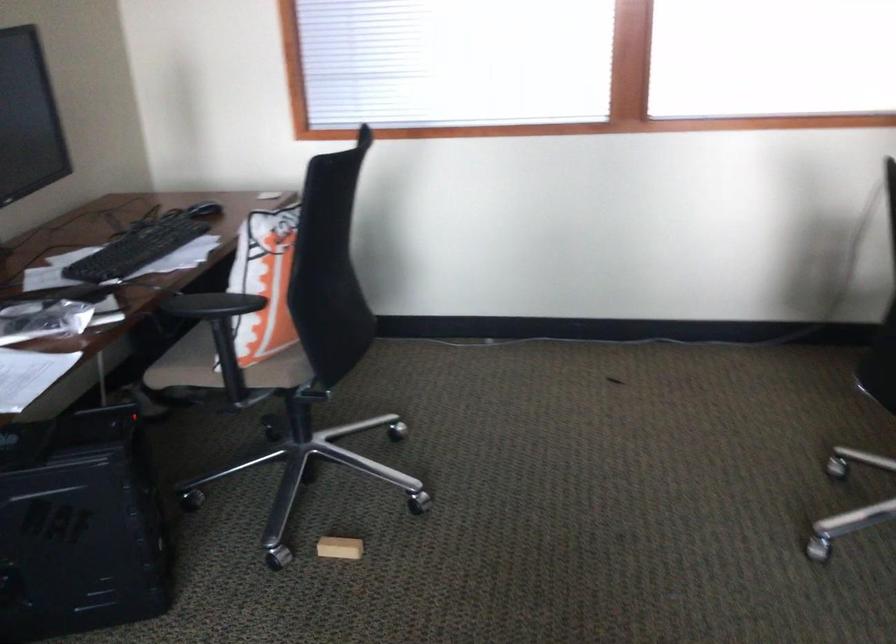
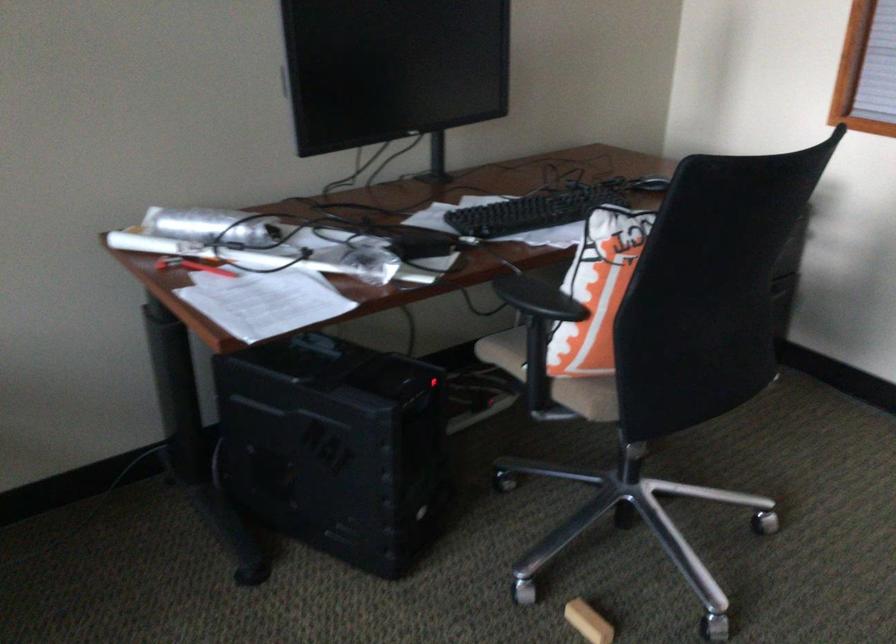
Locate, in the second image, the point that corresponds to point (213, 210) in the first image.

(648, 185)